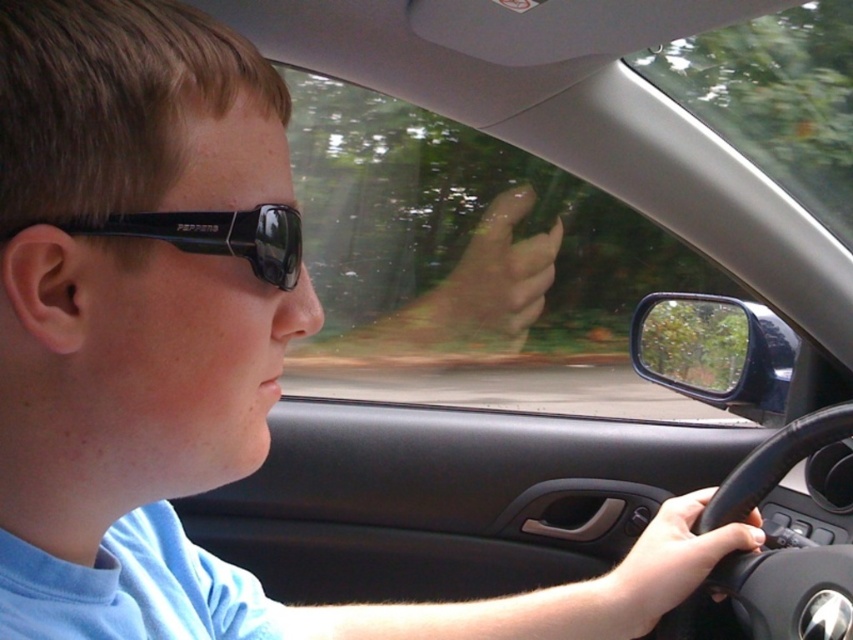
Question: Is black matte sunglasses at upper left further to the viewer compared to black leather steering wheel at lower right?

Choices:
 (A) yes
 (B) no

Answer: (B)

Question: Which object appears farthest from the camera in this image?

Choices:
 (A) black matte sunglasses at upper left
 (B) black leather steering wheel at lower right

Answer: (B)

Question: Can you confirm if black matte sunglasses at upper left is smaller than black leather steering wheel at lower right?

Choices:
 (A) yes
 (B) no

Answer: (A)

Question: Which point is farther from the camera taking this photo?

Choices:
 (A) (218, 225)
 (B) (778, 458)

Answer: (B)

Question: Does black matte sunglasses at upper left appear under black leather steering wheel at lower right?

Choices:
 (A) no
 (B) yes

Answer: (A)

Question: Which point appears closest to the camera in this image?

Choices:
 (A) (264, 220)
 (B) (782, 472)

Answer: (A)